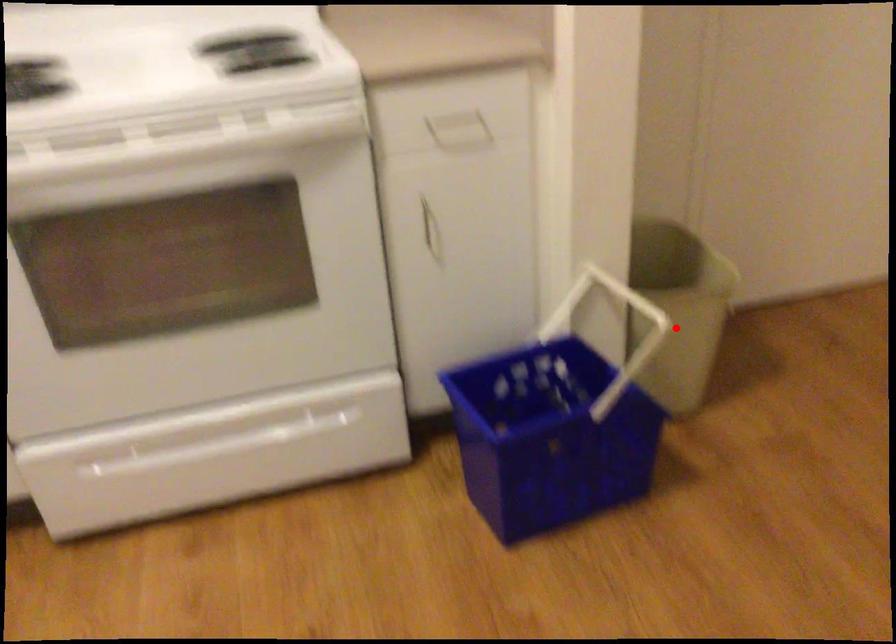
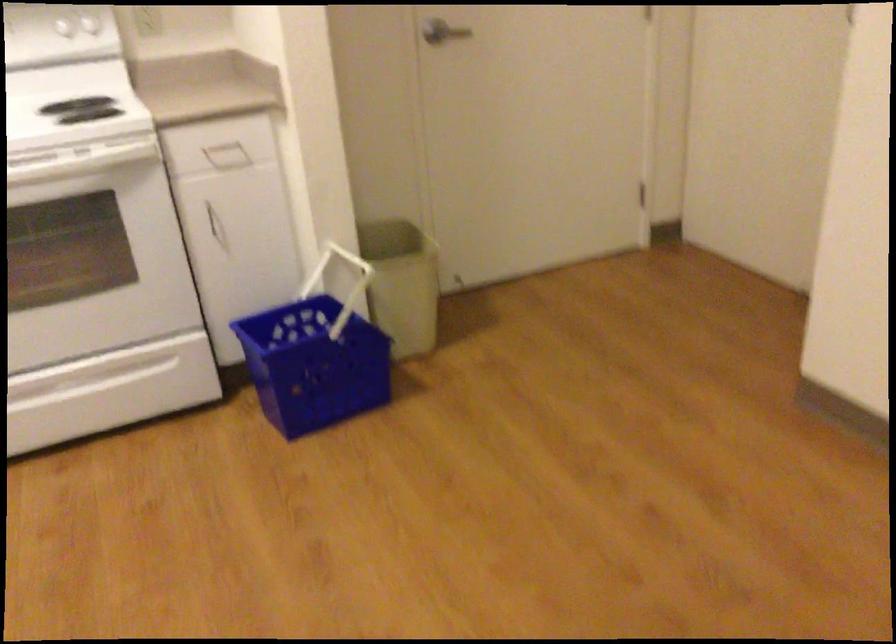
Find the pixel in the second image that matches the highlighted location in the first image.

(401, 283)